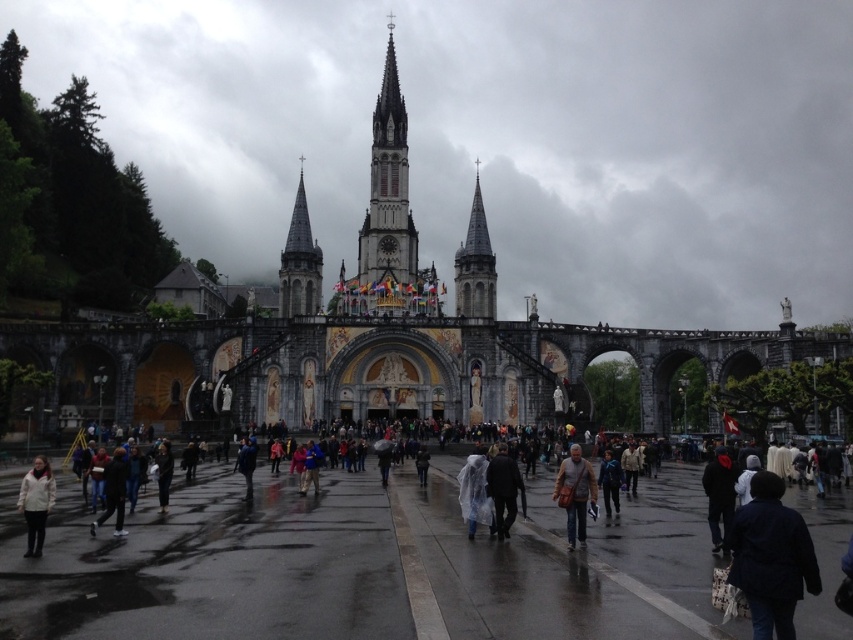
Which is in front, point (781, 547) or point (39, 476)?

Positioned in front is point (781, 547).

Is dark blue jacket at lower right to the right of white matte jacket at lower left from the viewer's perspective?

Yes, dark blue jacket at lower right is to the right of white matte jacket at lower left.

Is point (808, 563) farther from camera compared to point (27, 529)?

No, it is in front of (27, 529).

Where is `dark blue jacket at lower right`? This screenshot has width=853, height=640. dark blue jacket at lower right is located at coordinates (770, 557).

Is stone church at center below smooth gray stone tower at center?

No.

Between stone church at center and smooth gray stone tower at center, which one has more height?

stone church at center

Describe the element at coordinates (497, 138) in the screenshot. I see `stone church at center` at that location.

Locate an element on the screen. stone church at center is located at coordinates (497, 138).

Does smooth gray stone tower at center have a greater height compared to raincoat fabric at center?

Yes.

Image resolution: width=853 pixels, height=640 pixels. In order to click on smooth gray stone tower at center in this screenshot , I will do `click(474, 266)`.

Identify the location of smooth gray stone tower at center. The height and width of the screenshot is (640, 853). (474, 266).